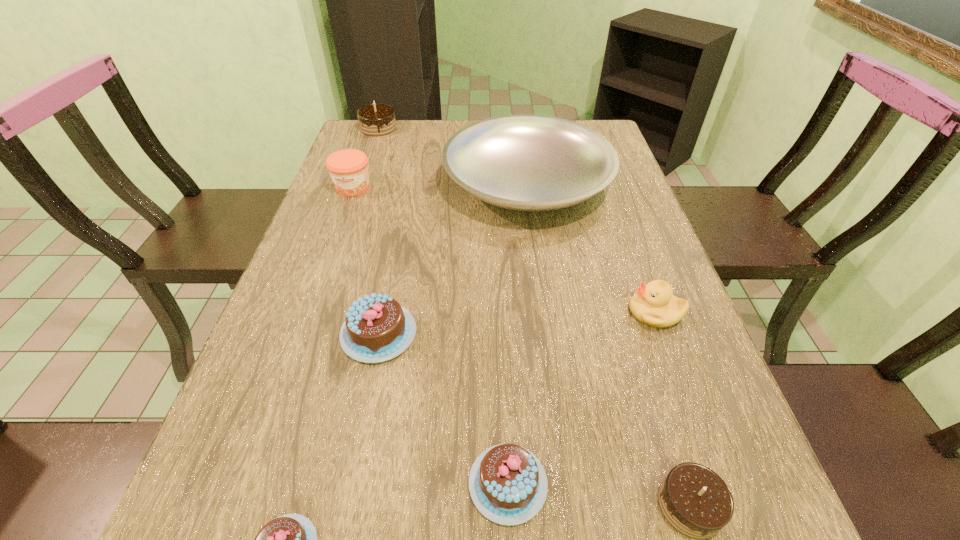
The width and height of the screenshot is (960, 540). What are the coordinates of `the fourth chocolate cake from left to right` in the screenshot? It's located at (508, 484).

You are a GUI agent. You are given a task and a screenshot of the screen. Output one action in this format:
    pyautogui.click(x=<x>, y=<y>)
    Task: Click on the free spot located 0.200m on the front of the farther chocolate chocolate cake
    This screenshot has height=540, width=960.
    Given the screenshot: What is the action you would take?
    pyautogui.click(x=364, y=169)

Find the location of `vacant space positioned on the front of the bedpan`. vacant space positioned on the front of the bedpan is located at coordinates [543, 303].

The width and height of the screenshot is (960, 540). In order to click on vacant region located on the front label of the jam in this screenshot , I will do `click(340, 224)`.

This screenshot has width=960, height=540. In order to click on free space located 0.140m at the face of the yellow duckling in this screenshot , I will do `click(562, 312)`.

Identify the location of vacant area situated 0.220m at the face of the yellow duckling. (523, 312).

At what (x,y) coordinates should I click in order to perform the action: click on vacant space located 0.320m at the face of the yellow duckling. Please return your answer as a coordinate pair (x, y). This screenshot has width=960, height=540. Looking at the image, I should click on (475, 312).

The height and width of the screenshot is (540, 960). I want to click on vacant position located 0.290m on the back of the biggest pink chocolate cake, so click(x=401, y=220).

At what (x,y) coordinates should I click in order to perform the action: click on vacant space situated on the left of the nearer chocolate chocolate cake. Please return your answer as a coordinate pair (x, y). The image size is (960, 540). Looking at the image, I should click on (612, 505).

What are the coordinates of `free space located on the right of the second biggest pink chocolate cake` in the screenshot? It's located at (652, 484).